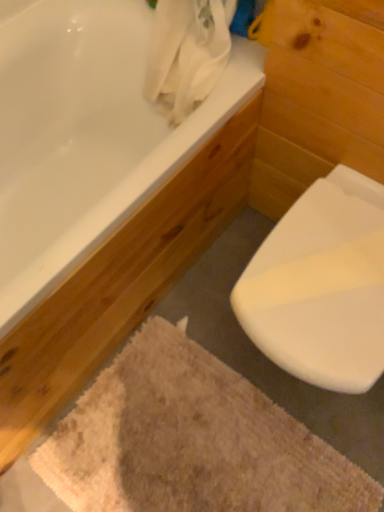
Question: From the image's perspective, is white glossy bathtub at upper left above or below beige textured bath mat at lower center?

Choices:
 (A) above
 (B) below

Answer: (A)

Question: In terms of height, does white glossy bathtub at upper left look taller or shorter compared to beige textured bath mat at lower center?

Choices:
 (A) tall
 (B) short

Answer: (A)

Question: Which object is the closest to the white glossy toilet at lower right?

Choices:
 (A) white glossy bathtub at upper left
 (B) beige textured bath mat at lower center

Answer: (B)

Question: Considering the real-world distances, which object is closest to the beige textured bath mat at lower center?

Choices:
 (A) white glossy bathtub at upper left
 (B) white glossy toilet at lower right

Answer: (B)